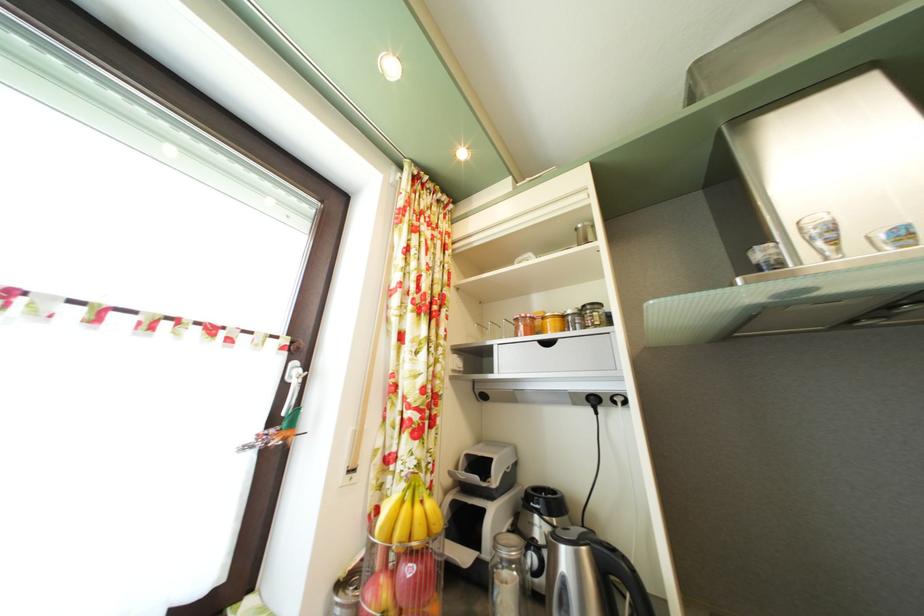
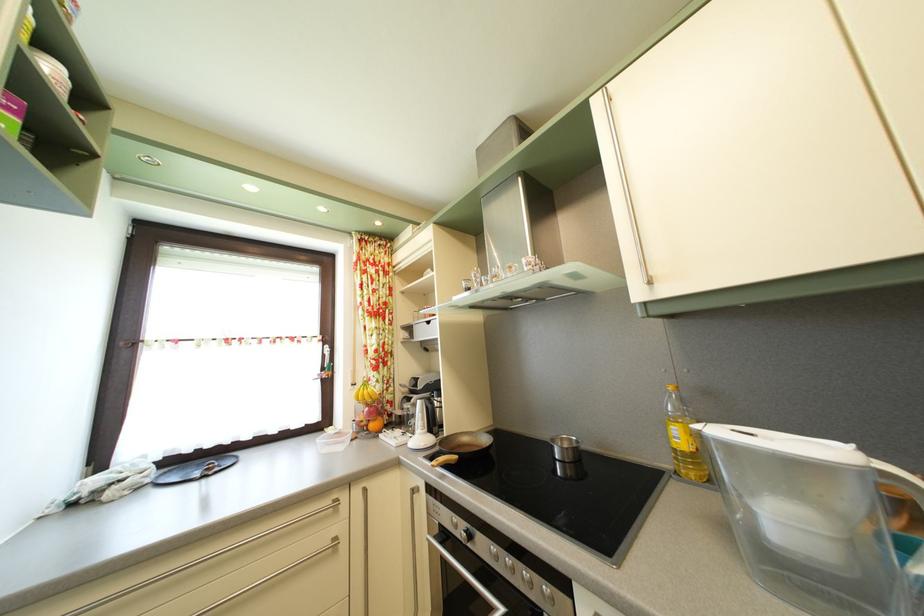
The images are taken continuously from a first-person perspective. In which direction are you moving?

The cameraman moved toward right, backward.